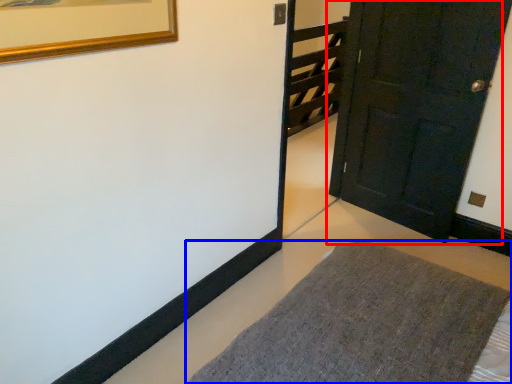
Question: Which object appears closest to the camera in this image, door (highlighted by a red box) or furniture (highlighted by a blue box)?

Choices:
 (A) door
 (B) furniture

Answer: (B)